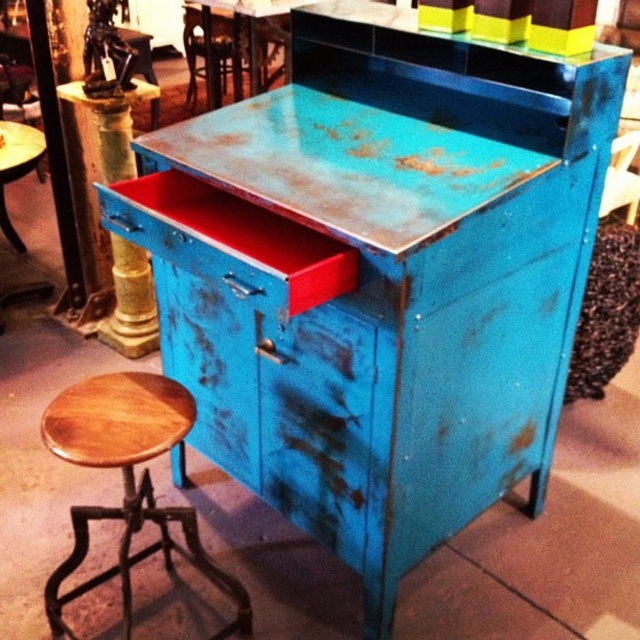
Is wooden chair at center thinner than metallic blue chair at center?

No, wooden chair at center is not thinner than metallic blue chair at center.

Is point (192, 26) behind point (636, 147)?

Yes, point (192, 26) is farther from viewer.

Where is `wooden chair at center`? wooden chair at center is located at coordinates (214, 51).

Consider the image. Does wooden seat stool at lower left have a larger size compared to wooden chair at center?

Incorrect, wooden seat stool at lower left is not larger than wooden chair at center.

Is wooden seat stool at lower left closer to the viewer compared to wooden chair at center?

Yes, wooden seat stool at lower left is closer to the viewer.

Where is `wooden seat stool at lower left`? wooden seat stool at lower left is located at coordinates (128, 483).

Which of these two, wooden seat stool at lower left or metallic blue chair at center, stands shorter?

With less height is metallic blue chair at center.

Can you confirm if wooden seat stool at lower left is positioned to the right of metallic blue chair at center?

Incorrect, wooden seat stool at lower left is not on the right side of metallic blue chair at center.

Locate an element on the screen. wooden seat stool at lower left is located at coordinates (128, 483).